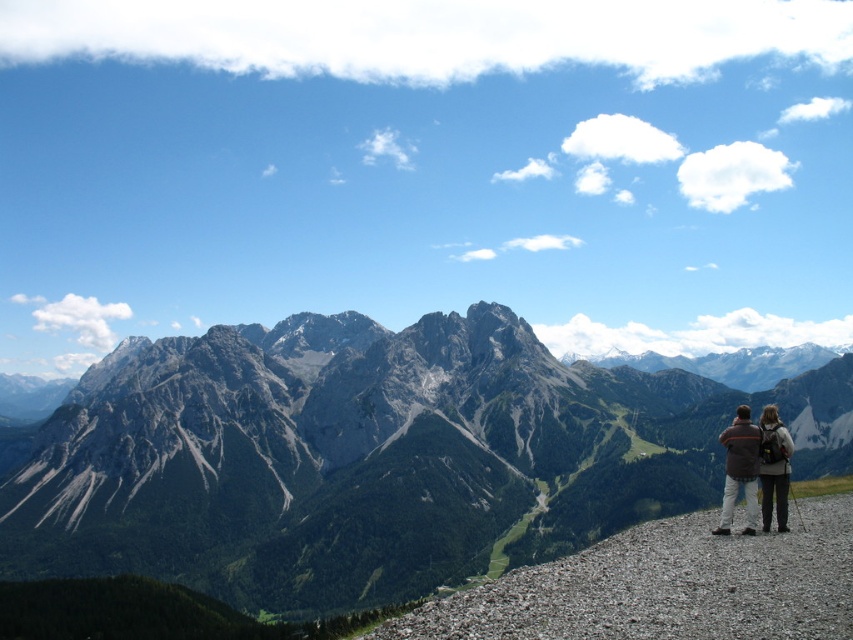
What do you see at coordinates (369, 458) in the screenshot? I see `gray rocky mountain range at center` at bounding box center [369, 458].

Is gray rocky mountain range at center closer to camera compared to dark brown leather jacket at lower right?

No, gray rocky mountain range at center is behind dark brown leather jacket at lower right.

At what (x,y) coordinates should I click in order to perform the action: click on gray rocky mountain range at center. Please return your answer as a coordinate pair (x, y). Image resolution: width=853 pixels, height=640 pixels. Looking at the image, I should click on pos(369,458).

Looking at this image, is dark brown leather jacket at lower right smaller than dark gray backpack at lower right?

No.

Where is `dark brown leather jacket at lower right`? dark brown leather jacket at lower right is located at coordinates (740, 468).

Between gray rocky mountain range at center and dark gray backpack at lower right, which one is positioned lower?

gray rocky mountain range at center is below.

Can you confirm if gray rocky mountain range at center is positioned above dark gray backpack at lower right?

Actually, gray rocky mountain range at center is below dark gray backpack at lower right.

The image size is (853, 640). What do you see at coordinates (369, 458) in the screenshot? I see `gray rocky mountain range at center` at bounding box center [369, 458].

I want to click on gray rocky mountain range at center, so click(x=369, y=458).